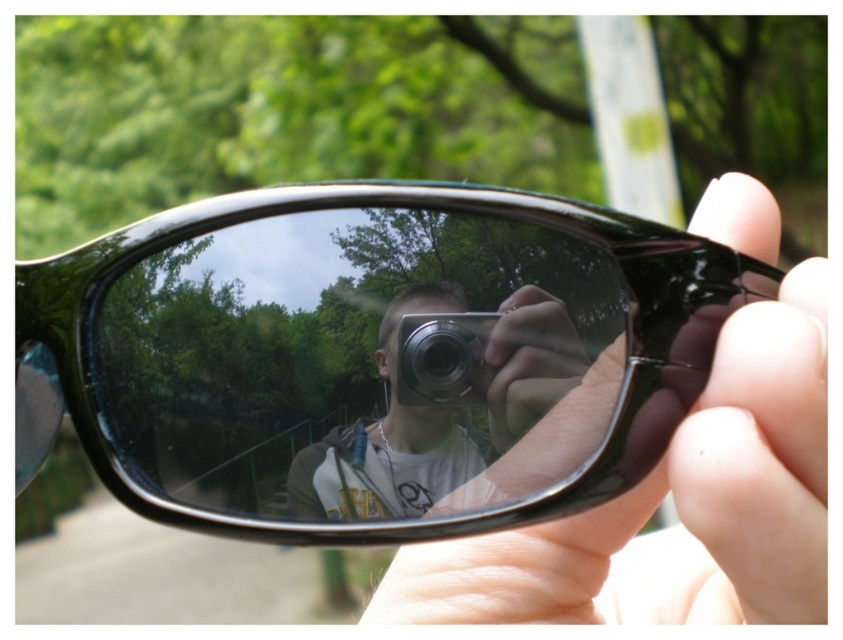
Consider the image. You are a photographer trying to focus on the reflection in the sunglasses. You notice two points marked in the image. Which point, point (693, 424) or point (524, 328), is closer to the camera and thus likely to be in sharper focus?

Point (693, 424) is closer to the camera than point (524, 328), so it will be in sharper focus.

You are trying to determine the position of two points in the image. Given that you are looking at the sunglasses and their reflection, which point is closer to you, point [513,316] or point [411,353]?

Point [513,316] is in front of point [411,353], so it is closer to you.

You are trying to take a selfie with your metallic silver camera at center. You want to make sure your matte black hand at center doesn

The matte black hand at center is much taller than the metallic silver camera at center, so it will likely block the camera